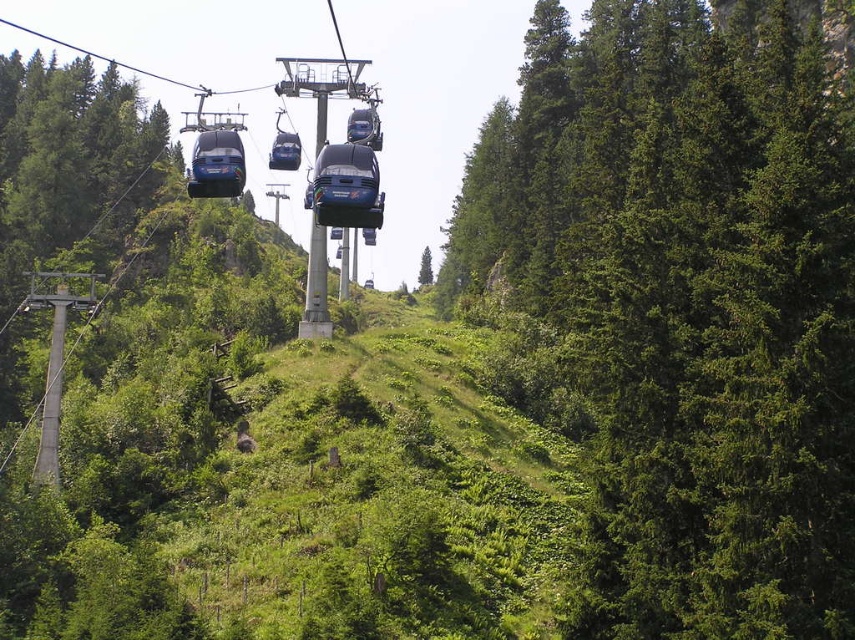
You are a passenger in the cable car system and want to know if the point at coordinates point (338, 212) is closer to you than point point (286, 150). Can you determine this based on your current view?

Point point (338, 212) is in front of point point (286, 150), so yes, it is closer to you.

You are a photographer planning to capture the entire scene of the green matte tree at right and the metallic blue cable car at center in one shot. Based on their sizes, which object would require you to adjust your camera angle to include more of its width in the frame?

The green matte tree at right has a larger width than the metallic blue cable car at center, so you would need to adjust your camera angle to include more of its width.